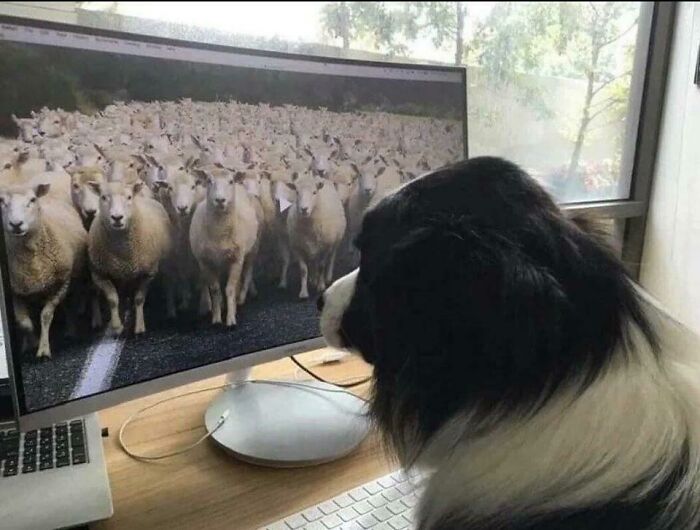
Find the location of a particular element. white wall is located at coordinates (680, 229).